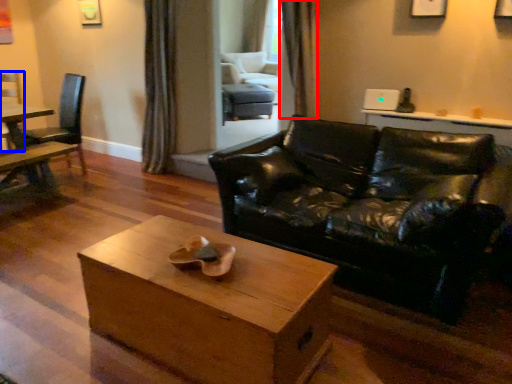
Question: Among these objects, which one is farthest to the camera, curtain (highlighted by a red box) or chair (highlighted by a blue box)?

Choices:
 (A) curtain
 (B) chair

Answer: (B)